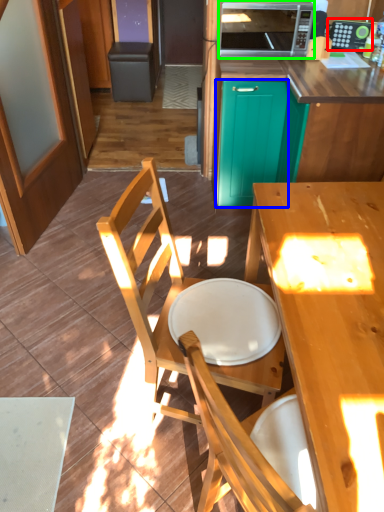
Question: Considering the real-world distances, which object is closest to appliance (highlighted by a red box)? screen door (highlighted by a blue box) or microwave oven (highlighted by a green box).

Choices:
 (A) screen door
 (B) microwave oven

Answer: (B)